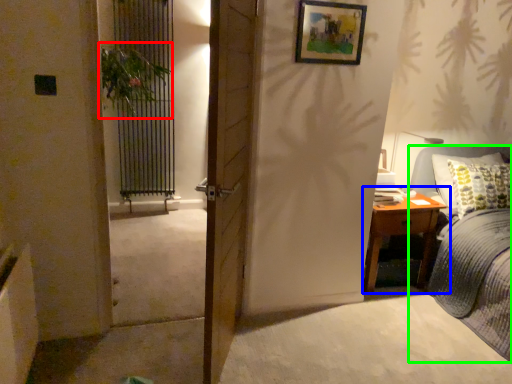
Question: Estimate the real-world distances between objects in this image. Which object is closer to plant (highlighted by a red box), nightstand (highlighted by a blue box) or bed (highlighted by a green box)?

Choices:
 (A) nightstand
 (B) bed

Answer: (A)